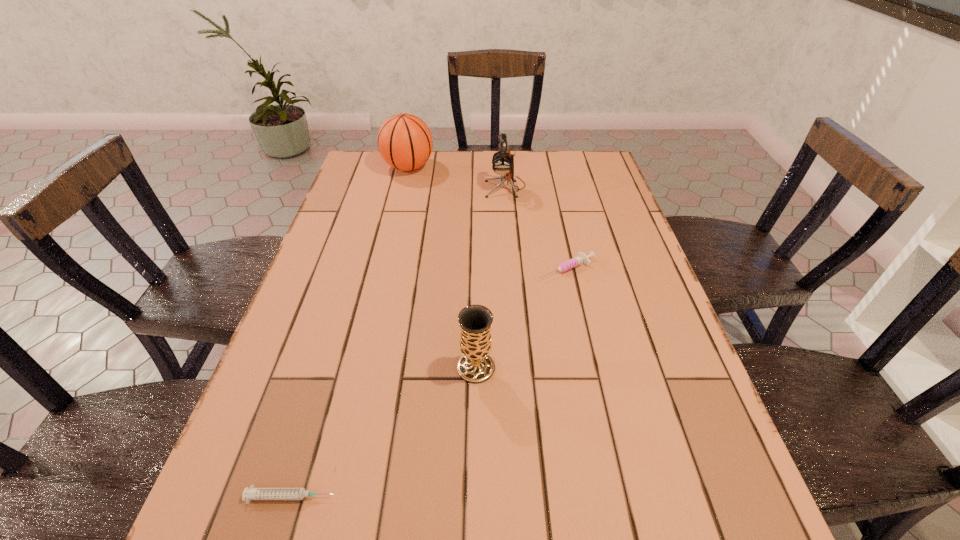
Image resolution: width=960 pixels, height=540 pixels. I want to click on earphone, so click(502, 162).

Where is `basketball`? basketball is located at coordinates coord(405,142).

At what (x,y) coordinates should I click in order to perform the action: click on the third tallest object. Please return your answer as a coordinate pair (x, y). Looking at the image, I should click on (475, 366).

The width and height of the screenshot is (960, 540). Identify the location of the fourth farthest object. (475, 366).

The image size is (960, 540). In order to click on the right syringe in this screenshot , I will do `click(581, 258)`.

Locate an element on the screen. This screenshot has height=540, width=960. the third nearest object is located at coordinates (581, 258).

Image resolution: width=960 pixels, height=540 pixels. Find the location of `the left syringe`. the left syringe is located at coordinates (251, 493).

Identify the location of the shortest object. (251, 493).

Locate an element on the screen. free space located 0.180m on the left of the earphone is located at coordinates (428, 187).

This screenshot has width=960, height=540. What are the coordinates of `vacant area located on the front of the basketball` in the screenshot? It's located at (391, 242).